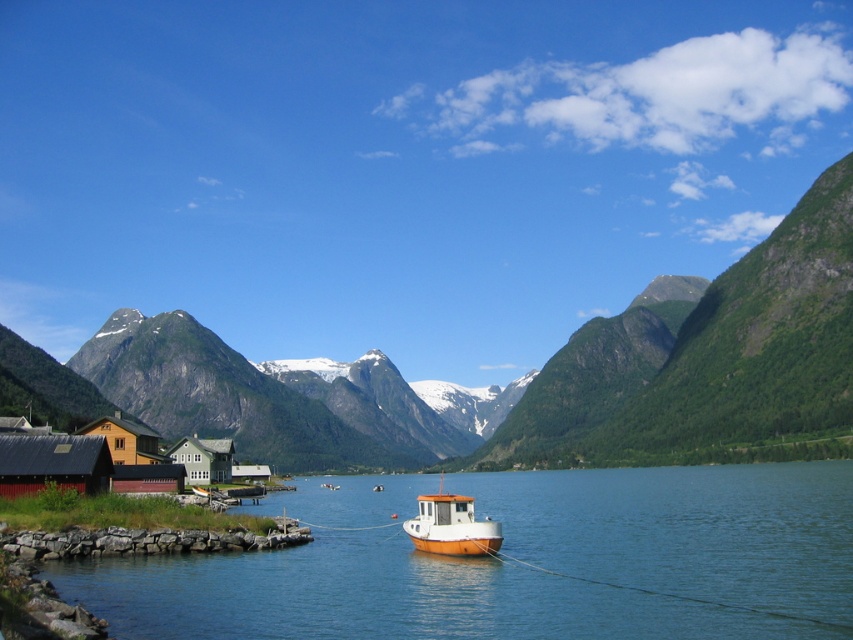
Question: Is green grassy mountain at center closer to camera compared to yellow wood house at lower left?

Choices:
 (A) yes
 (B) no

Answer: (B)

Question: Which is farther from the orange matte boat at center?

Choices:
 (A) green matte house at lower left
 (B) yellow wood house at lower left
 (C) clear blue water at lower left
 (D) green grassy mountain at center

Answer: (D)

Question: Can you confirm if orange matte boat at center is positioned above yellow wood house at lower left?

Choices:
 (A) yes
 (B) no

Answer: (B)

Question: Which point is closer to the camera?

Choices:
 (A) clear blue water at lower left
 (B) matte red barn at lower left

Answer: (A)

Question: Estimate the real-world distances between objects in this image. Which object is closer to the green matte house at lower left?

Choices:
 (A) clear blue water at lower left
 (B) orange matte boat at center
 (C) yellow wood house at lower left
 (D) matte red barn at lower left

Answer: (C)

Question: In this image, where is matte red barn at lower left located relative to yellow wood house at lower left?

Choices:
 (A) right
 (B) left

Answer: (A)